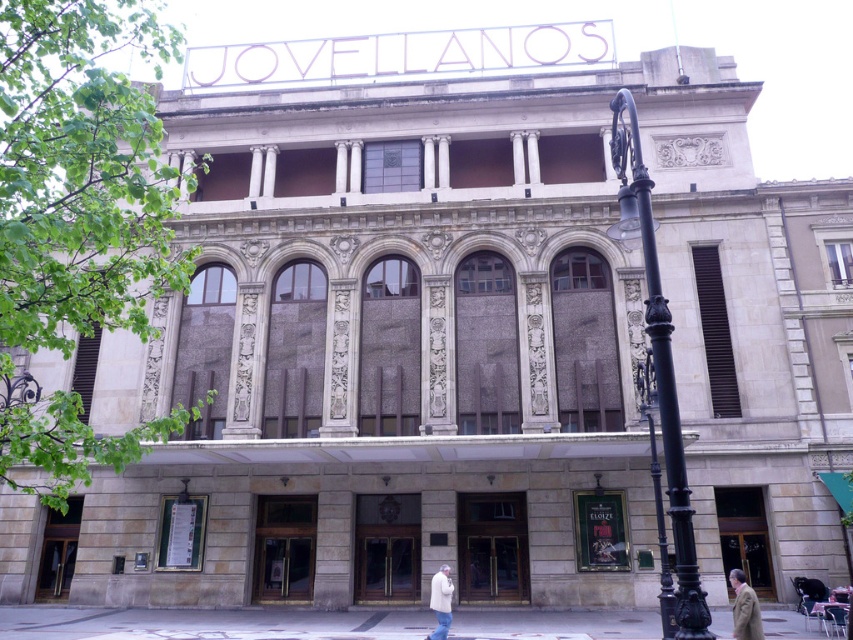
You are standing in front of the Jovellanos building and want to walk towards the black wrought iron streetlight at right. Which direction should you move relative to the smooth concrete pavement at lower center?

The black wrought iron streetlight at right is behind the smooth concrete pavement at lower center, so you should move towards the right side of the smooth concrete pavement at lower center to reach it.

You are standing in front of the Jovellanos building and see two people wearing coats. Which person is wearing the brown wool coat at lower right closer to the right side of the white wool coat at lower center?

The brown wool coat at lower right is positioned on the right side of the white wool coat at lower center, so the person wearing the brown wool coat at lower right is closer to the right side of the white wool coat at lower center.

You are a photographer standing in front of the Jovellanos building. You want to take a photo that includes both the black wrought iron streetlight at right and the white wool coat at lower center. Since you need to ensure both are fully visible in the frame, which object should you position closer to the camera to avoid cropping?

The black wrought iron streetlight at right is taller than the white wool coat at lower center. To ensure both are fully visible, position the white wool coat at lower center closer to the camera so its smaller height remains in frame while the taller streetlight can be accommodated by adjusting the angle or zoom.